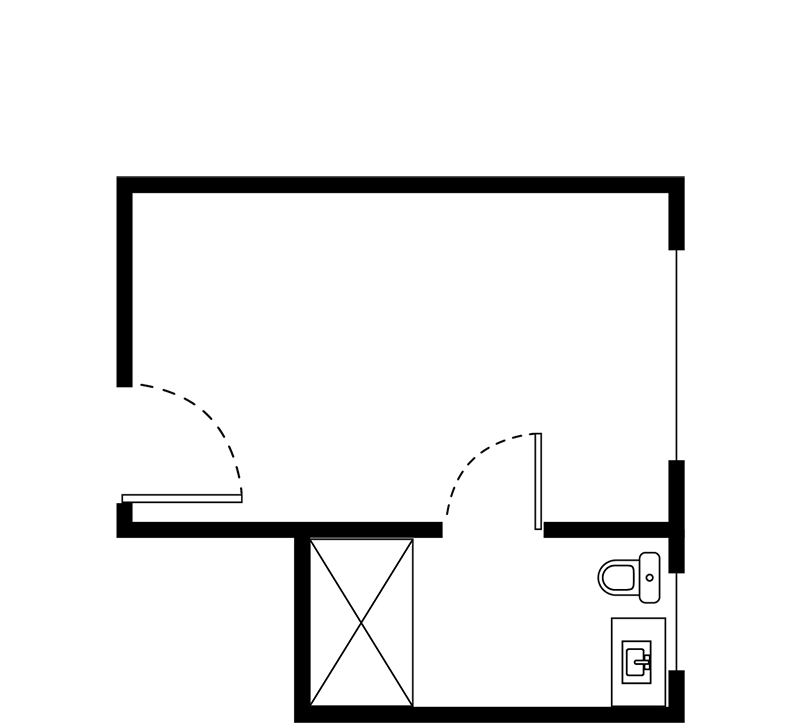
Find the location of a particular element. The width and height of the screenshot is (800, 723). sink is located at coordinates (632, 658).